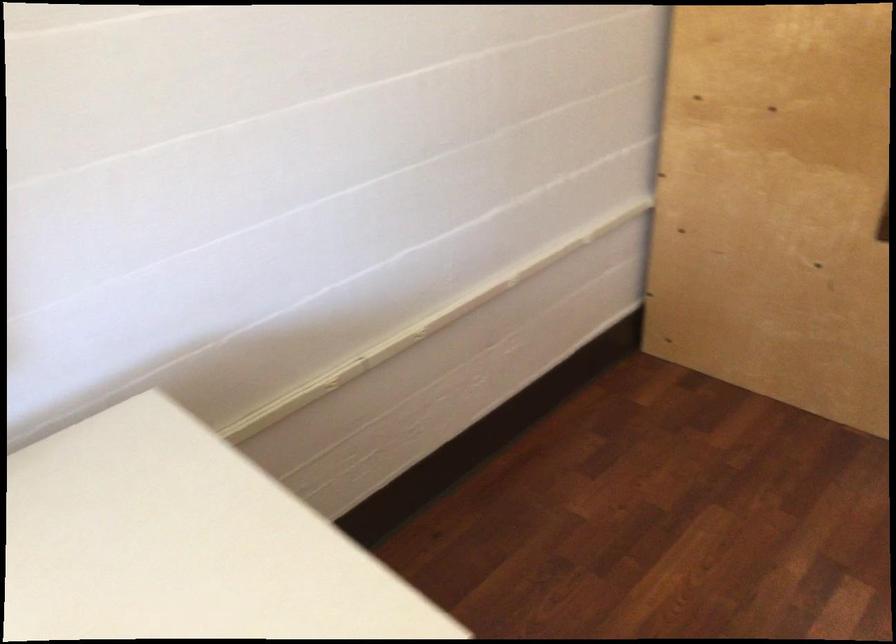
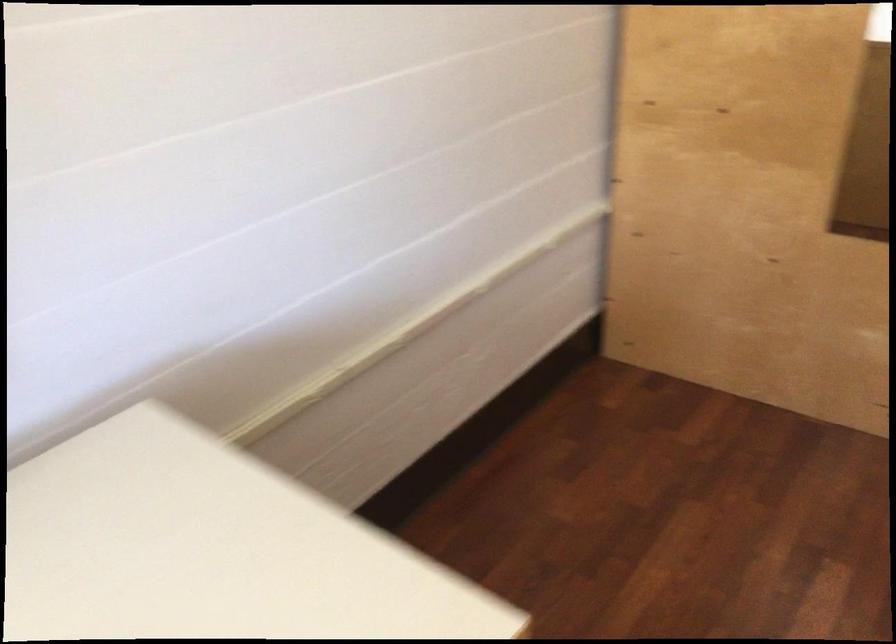
Question: The images are taken continuously from a first-person perspective. In which direction is your viewpoint rotating?

Choices:
 (A) Left
 (B) Right
 (C) Up
 (D) Down

Answer: (B)